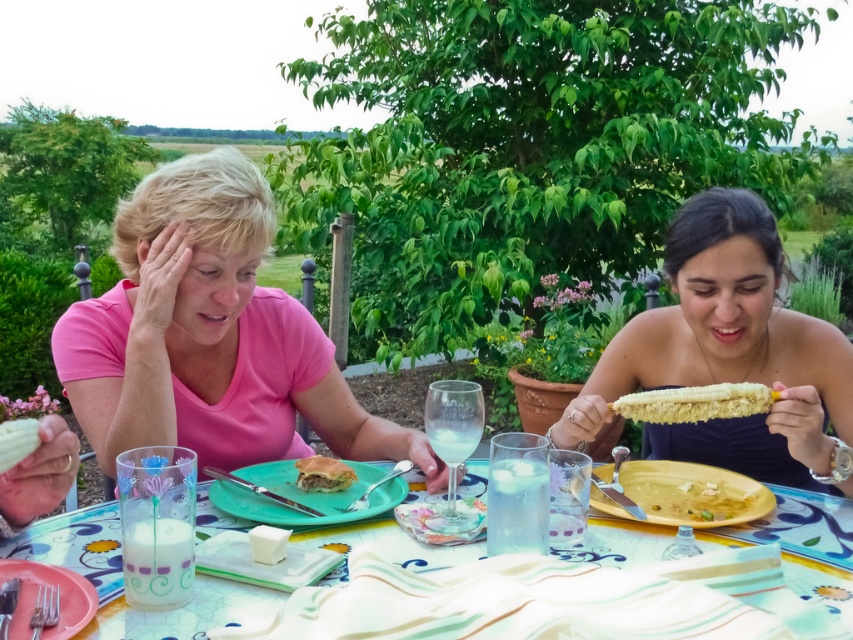
You are setting up a picnic and have a green matte plate at center and a plastic pink plate at lower left. Which plate is placed on top of the other?

The green matte plate at center is positioned over plastic pink plate at lower left, so the green matte plate is on top.

You are setting up a picnic and need to place a small container between the yellow matte plate at lower right and the yellow corn cob at right. Based on their heights, which object should the container be placed closer to?

The yellow matte plate at lower right is shorter than the yellow corn cob at right, so the container should be placed closer to the yellow matte plate at lower right to ensure stability.

You are setting up a picnic and need to place two plates on the table. The green matte plate at center and the plastic pink plate at lower left are the only ones available. If you want to serve a main course on the larger plate, which one should you choose?

The green matte plate at center should be chosen because its width is larger than the plastic pink plate at lower left.